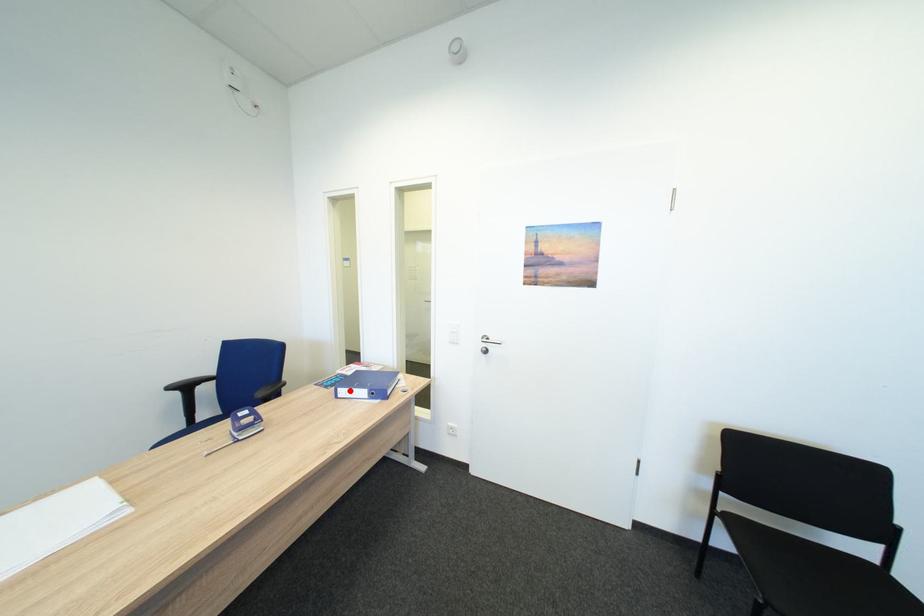
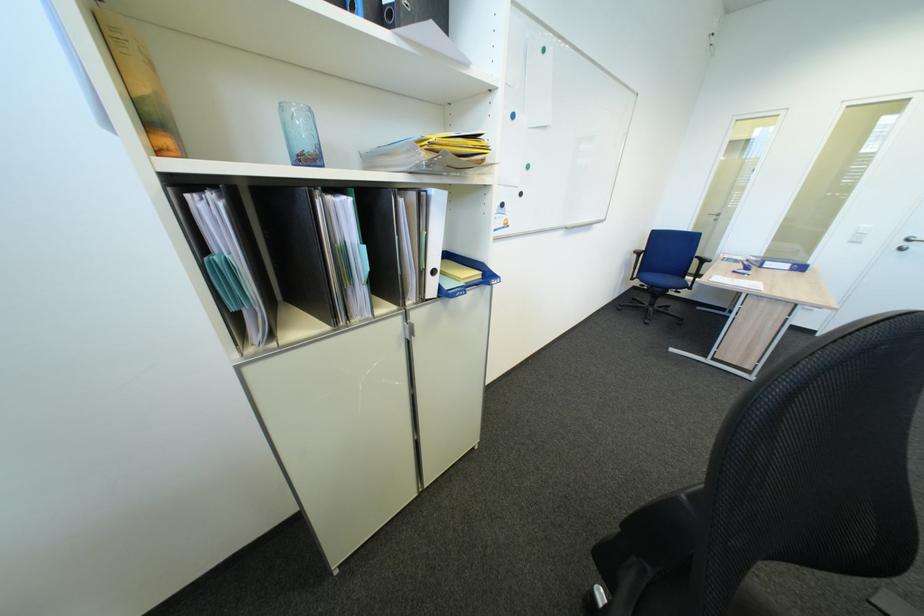
Where in the second image is the point corresponding to the highlighted location from the first image?

(776, 264)